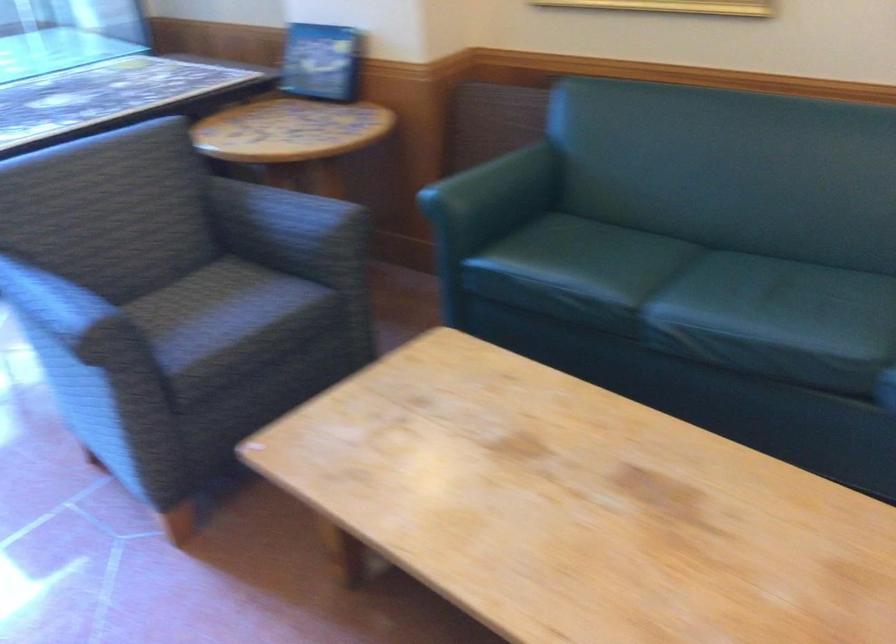
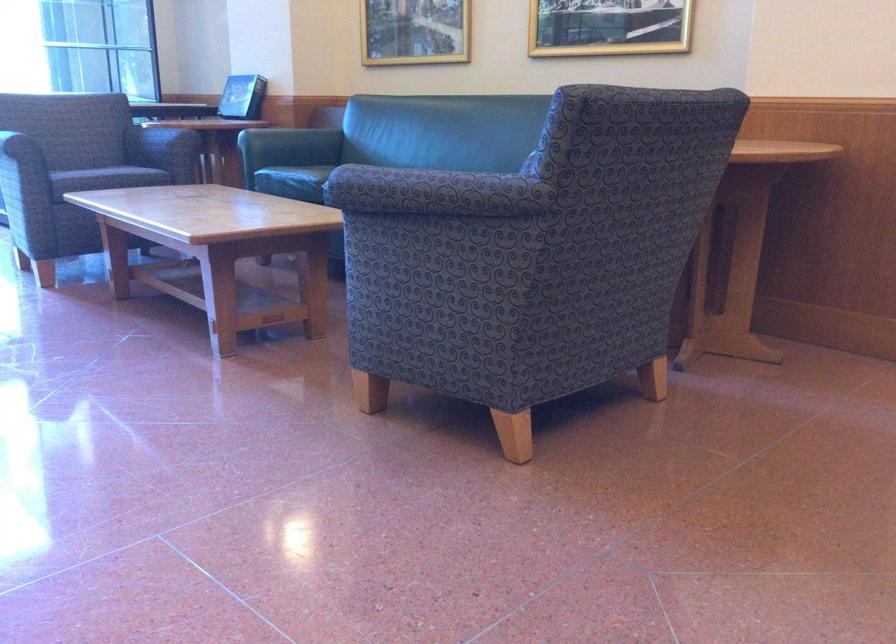
Where in the second image is the point corresponding to the point at 121,384 from the first image?

(14, 146)